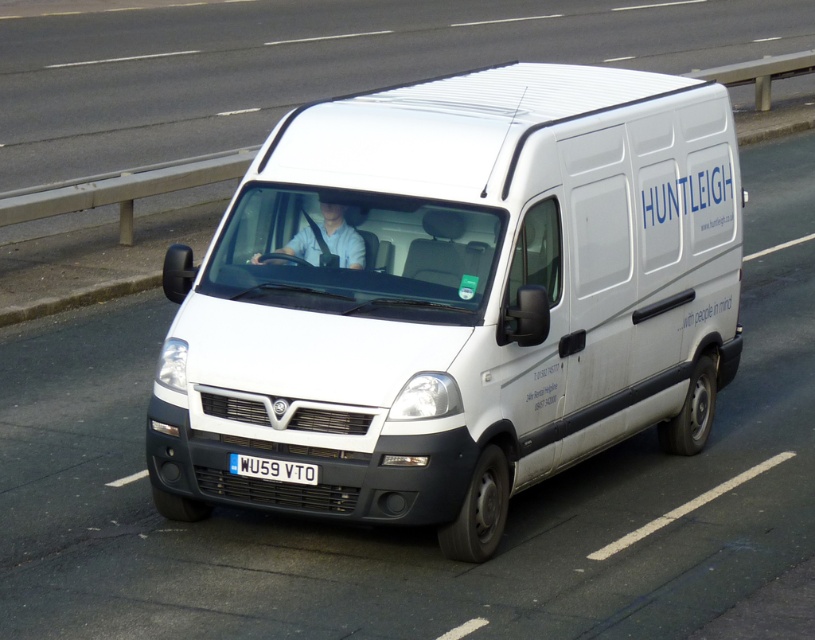
Does white matte van at center come behind white plastic license plate at center?

No.

Who is positioned more to the left, white matte van at center or white plastic license plate at center?

white plastic license plate at center is more to the left.

Is point (258, 170) behind point (289, 481)?

Yes, it is.

This screenshot has height=640, width=815. I want to click on white matte van at center, so click(x=456, y=298).

Does white matte van at center have a smaller size compared to white van at center?

Yes, white matte van at center is smaller than white van at center.

Does white matte van at center appear under white van at center?

Correct, white matte van at center is located below white van at center.

Who is more distant from viewer, (x=394, y=250) or (x=232, y=3)?

Point (x=232, y=3)

You are a GUI agent. You are given a task and a screenshot of the screen. Output one action in this format:
    pyautogui.click(x=<x>, y=<y>)
    Task: Click on the white matte van at center
    
    Given the screenshot: What is the action you would take?
    pyautogui.click(x=456, y=298)

Which is more to the left, white van at center or white plastic license plate at center?

Positioned to the left is white plastic license plate at center.

Describe the element at coordinates (315, 65) in the screenshot. This screenshot has width=815, height=640. I see `white van at center` at that location.

Image resolution: width=815 pixels, height=640 pixels. Describe the element at coordinates (315, 65) in the screenshot. I see `white van at center` at that location.

Identify the location of white van at center. The height and width of the screenshot is (640, 815). (315, 65).